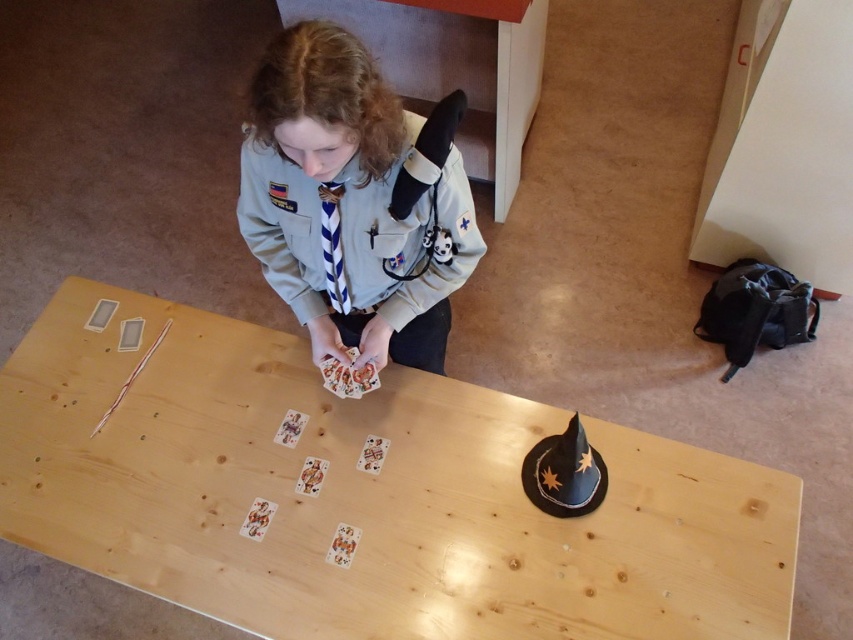
Question: Can you confirm if light wood table at center is positioned to the left of light gray uniform at center?

Choices:
 (A) no
 (B) yes

Answer: (B)

Question: Which of the following is the closest to the observer?

Choices:
 (A) (720, 618)
 (B) (282, 132)

Answer: (B)

Question: Which of the following is the farthest from the observer?

Choices:
 (A) light gray uniform at center
 (B) light wood table at center

Answer: (B)

Question: Does light wood table at center have a larger size compared to light gray uniform at center?

Choices:
 (A) yes
 (B) no

Answer: (A)

Question: Does light wood table at center have a greater width compared to light gray uniform at center?

Choices:
 (A) no
 (B) yes

Answer: (B)

Question: Among these objects, which one is nearest to the camera?

Choices:
 (A) light gray uniform at center
 (B) light wood table at center

Answer: (A)